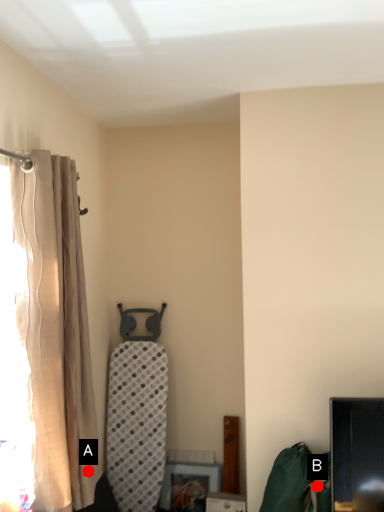
Question: Two points are circled on the image, labeled by A and B beside each circle. Which point is further to the camera?

Choices:
 (A) A is further
 (B) B is further

Answer: (A)